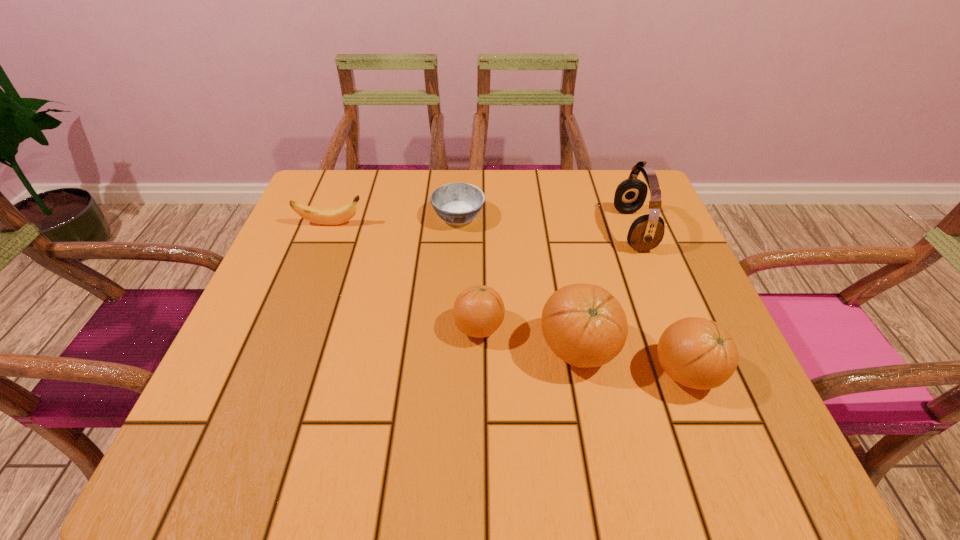
Identify the location of blank region between the tallest orange and the banana. (454, 287).

Identify which object is located as the fifth nearest to the second orange from right to left. Please provide its 2D coordinates. Your answer should be formatted as a tuple, i.e. [(x, y)], where the tuple contains the x and y coordinates of a point satisfying the conditions above.

[(321, 216)]

At what (x,y) coordinates should I click in order to perform the action: click on object that stands as the third closest to the leftmost orange. Please return your answer as a coordinate pair (x, y). The width and height of the screenshot is (960, 540). Looking at the image, I should click on (698, 353).

Where is `orange that is the closest to the fourth object from left to right`? Image resolution: width=960 pixels, height=540 pixels. orange that is the closest to the fourth object from left to right is located at coordinates (698, 353).

Locate an element on the screen. This screenshot has width=960, height=540. the second closest orange to the tallest orange is located at coordinates (479, 311).

Identify the location of vacant space that satisfies the following two spatial constraints: 1. on the ear cups of the headset; 2. on the front side of the fourth shortest object. [x=688, y=373].

You are a GUI agent. You are given a task and a screenshot of the screen. Output one action in this format:
    pyautogui.click(x=<x>, y=<y>)
    Task: Click on the vacant space that satisfies the following two spatial constraints: 1. on the front side of the leftmost orange; 2. on the right side of the second shortest orange
    This screenshot has height=540, width=960.
    Given the screenshot: What is the action you would take?
    pyautogui.click(x=479, y=373)

I want to click on vacant region that satisfies the following two spatial constraints: 1. on the front side of the leftmost orange; 2. on the right side of the rightmost orange, so click(479, 373).

Locate an element on the screen. The image size is (960, 540). vacant region that satisfies the following two spatial constraints: 1. at the stem of the second shortest orange; 2. on the left side of the banana is located at coordinates (275, 373).

Locate an element on the screen. The height and width of the screenshot is (540, 960). vacant space that satisfies the following two spatial constraints: 1. on the back side of the leftmost orange; 2. at the stem of the banana is located at coordinates (479, 224).